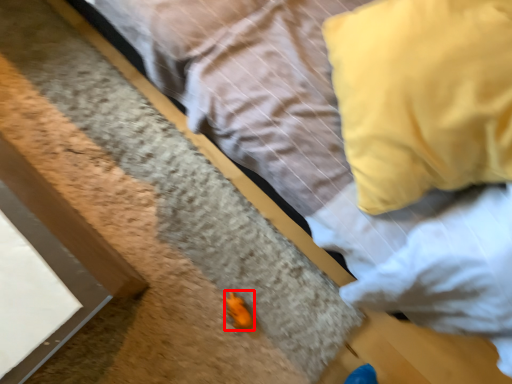
Question: Where is miniature (annotated by the red box) located in relation to pillow in the image?

Choices:
 (A) right
 (B) left

Answer: (B)